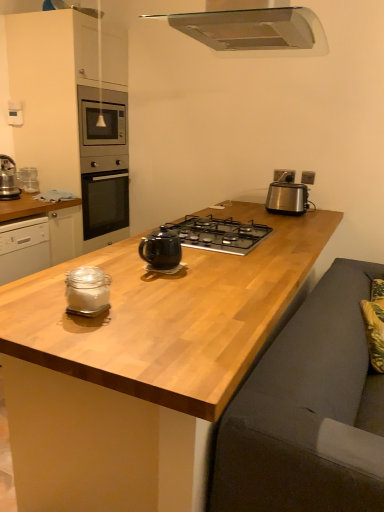
Identify the location of free spot to the right of black glossy teapot at center. The width and height of the screenshot is (384, 512). coord(215,267).